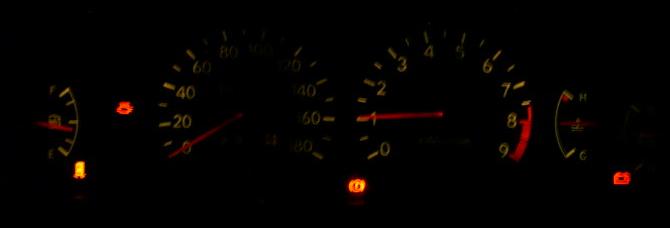
The image size is (670, 228). In order to click on light in this screenshot , I will do `click(356, 184)`, `click(78, 166)`, `click(124, 106)`, `click(620, 177)`.